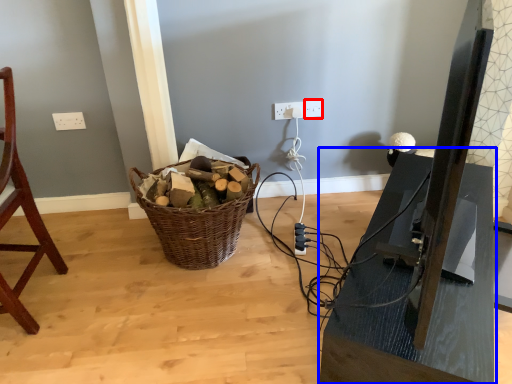
Question: Among these objects, which one is farthest to the camera, electric outlet (highlighted by a red box) or table (highlighted by a blue box)?

Choices:
 (A) electric outlet
 (B) table

Answer: (A)